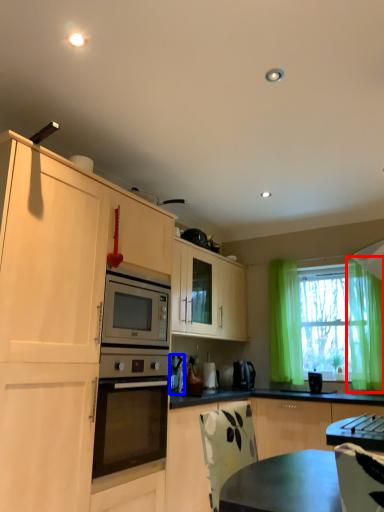
Question: Among these objects, which one is nearest to the camera, curtain (highlighted by a red box) or appliance (highlighted by a blue box)?

Choices:
 (A) curtain
 (B) appliance

Answer: (A)